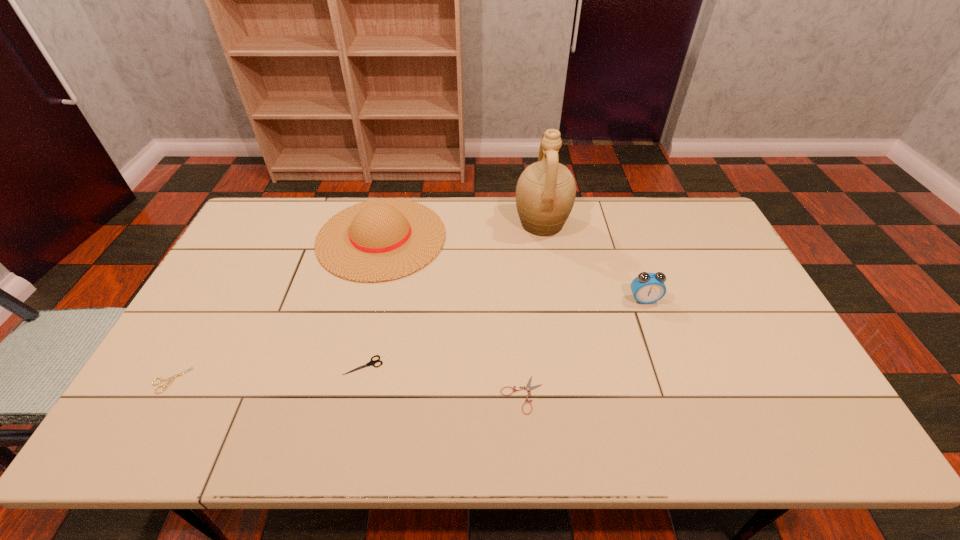
Identify the location of shears identified as the closest to the tallest shears. (528, 388).

Where is `free point that satisfies the following two spatial constraints: 1. on the front side of the bonnet; 2. on the left side of the shortest object`? This screenshot has height=540, width=960. free point that satisfies the following two spatial constraints: 1. on the front side of the bonnet; 2. on the left side of the shortest object is located at coordinates (343, 395).

Where is `vacant space that satisfies the following two spatial constraints: 1. on the back side of the leftmost object; 2. on the left side of the pitcher`? This screenshot has height=540, width=960. vacant space that satisfies the following two spatial constraints: 1. on the back side of the leftmost object; 2. on the left side of the pitcher is located at coordinates (260, 223).

Find the location of a particular element. Image resolution: width=960 pixels, height=540 pixels. free location that satisfies the following two spatial constraints: 1. on the back side of the tallest object; 2. on the left side of the shortest shears is located at coordinates (509, 223).